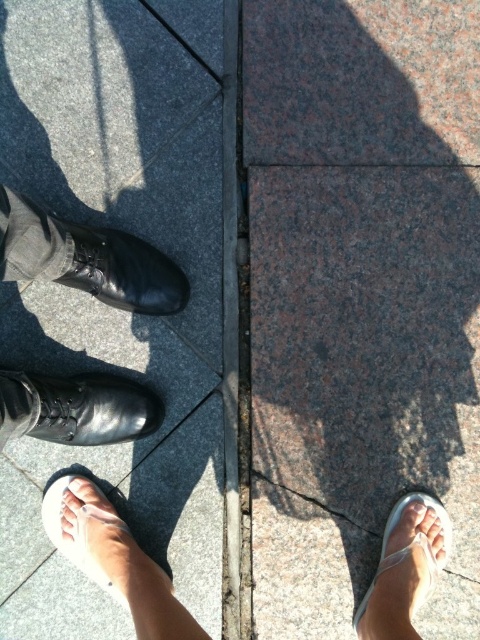
You are standing in the scene and want to place a small object exactly at the center of the image. Given the white fabric sandal at lower right, where would you place the object to ensure it is equidistant from the sandal and the center of the image?

To place the object equidistant from the white fabric sandal at lower right and the center of the image, you would position it halfway between the sandal and the center. The center of the image is at point [240,320]. The sandal is at [405,566]. The midpoint between these two points would be at coordinates [322,444].

You are standing on the gray polished concrete at center and want to step onto the black leather shoe at left. Is this possible given their positions?

The black leather shoe at left is behind the gray polished concrete at center, so stepping onto it would require moving backward from your current position on the gray polished concrete at center.

Based on the photo, you are a delivery person trying to place a small package between the shiny black shoes at left and the white fabric sandal at lower right. Given their sizes, can the package fit in the space between them?

The shiny black shoes at left has a larger size compared to white fabric sandal at lower right, so the space between them may be sufficient to fit the small package, but it depends on the exact dimensions of the package and the gap between the shoes and sandal.